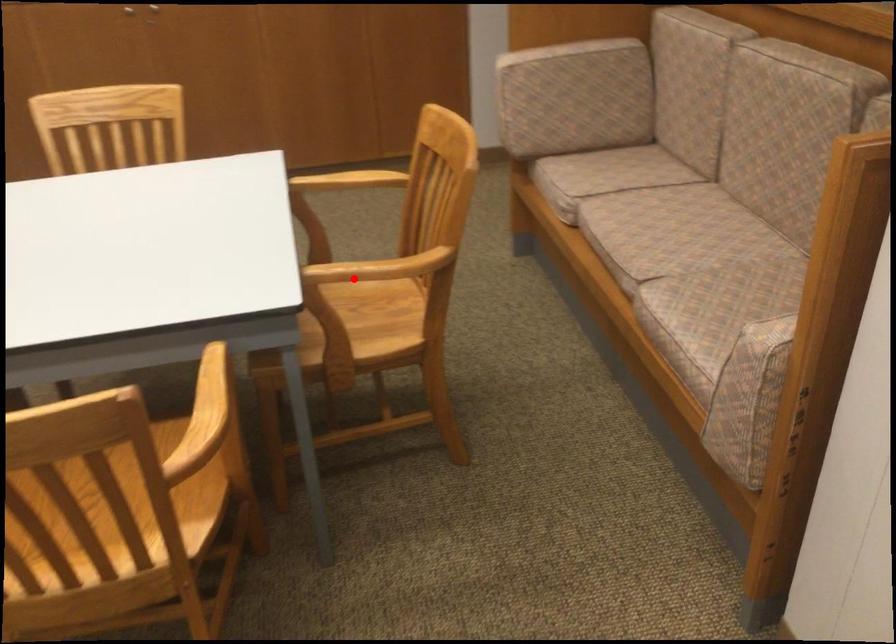
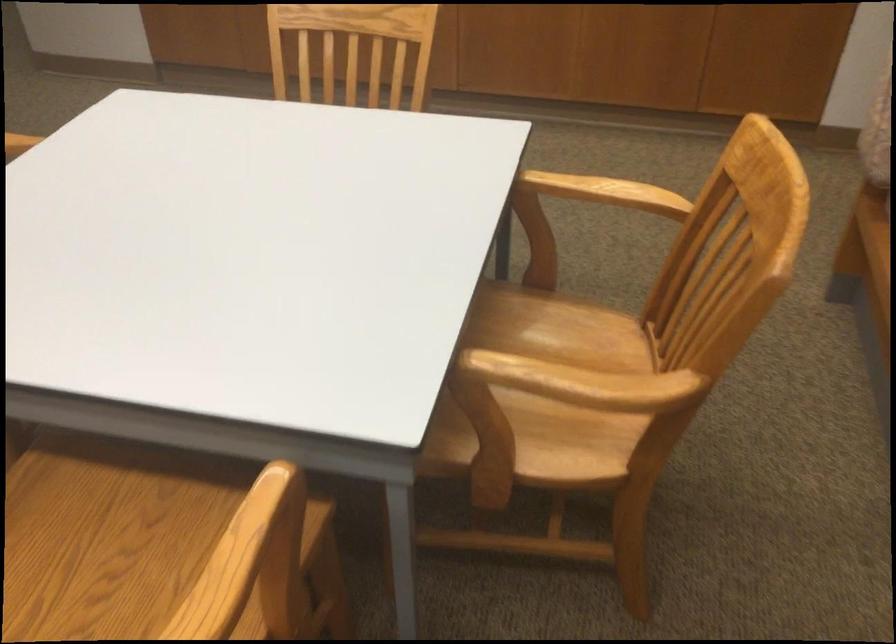
Question: I am providing you with two images of the same scene from different viewpoints. A red point is shown in image1. For the corresponding object point in image2, is it positioned nearer or farther from the camera?

Choices:
 (A) Nearer
 (B) Farther

Answer: (A)